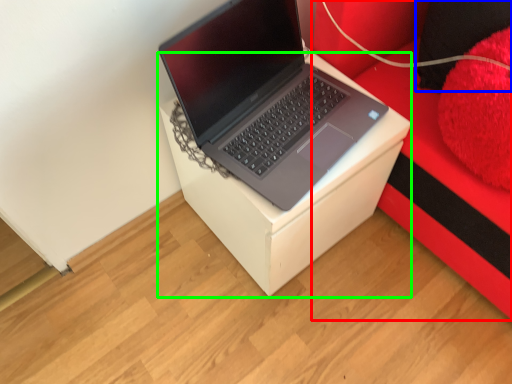
Question: Which is farther away from furniture (highlighted by a red box)? pillow (highlighted by a blue box) or table (highlighted by a green box)?

Choices:
 (A) pillow
 (B) table

Answer: (B)